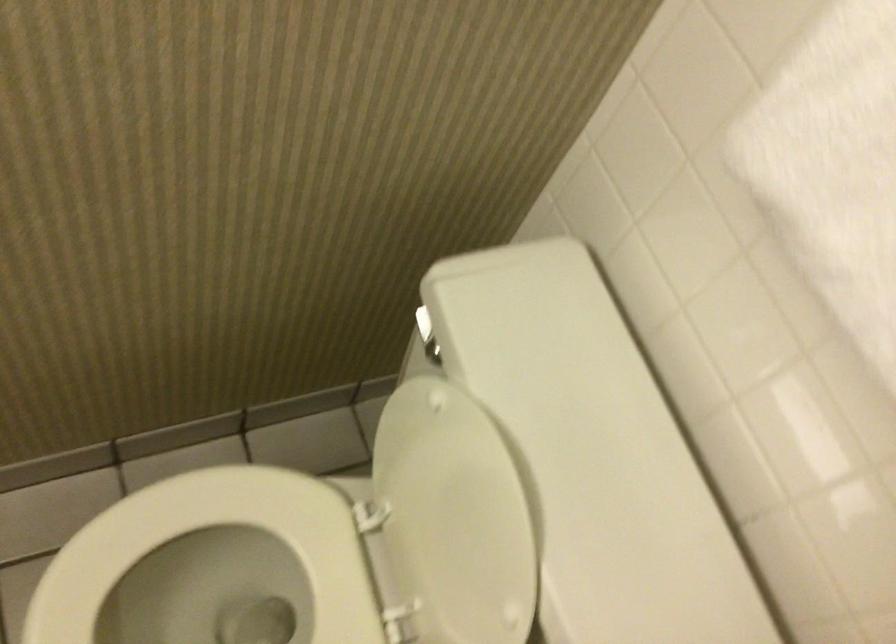
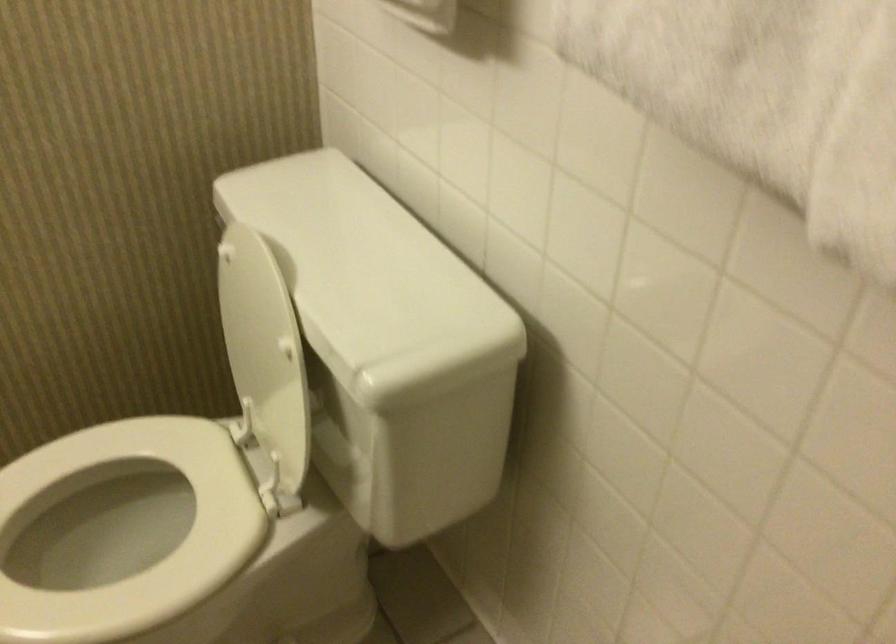
Locate, in the second image, the point that corresponds to (175,567) in the first image.

(97, 545)